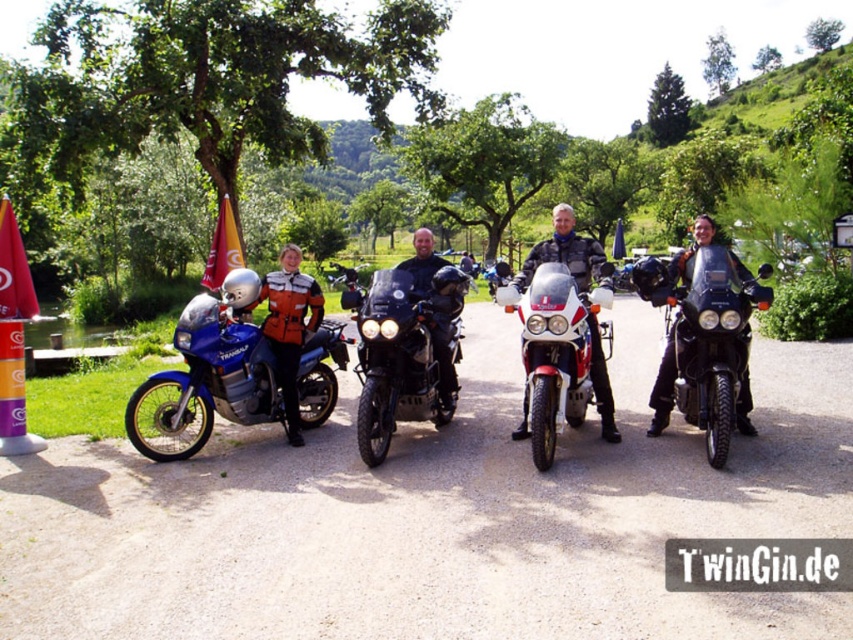
Between point (567, 268) and point (450, 275), which one is positioned in front?

Point (450, 275) is in front.

Is point (546, 291) farther from viewer compared to point (421, 252)?

No, (546, 291) is closer to viewer.

Does point (540, 342) come in front of point (440, 301)?

That is True.

Where is `red matte sportbike at center`? red matte sportbike at center is located at coordinates (554, 355).

Does shiny black motorcycle at center have a greater height compared to orange leather jacket at left?

No.

Does shiny black motorcycle at center have a smaller size compared to orange leather jacket at left?

Actually, shiny black motorcycle at center might be larger than orange leather jacket at left.

Find the location of a particular element. The image size is (853, 640). shiny black motorcycle at center is located at coordinates (398, 356).

Locate an element on the screen. shiny black motorcycle at center is located at coordinates (398, 356).

Does matte blue motorcycle at left have a greater height compared to matte black motorcycle at center?

No, matte blue motorcycle at left is not taller than matte black motorcycle at center.

Can you confirm if matte blue motorcycle at left is bigger than matte black motorcycle at center?

Correct, matte blue motorcycle at left is larger in size than matte black motorcycle at center.

Which is in front, point (242, 388) or point (432, 296)?

Point (432, 296) is more forward.

You are a GUI agent. You are given a task and a screenshot of the screen. Output one action in this format:
    pyautogui.click(x=<x>, y=<y>)
    Task: Click on the matte blue motorcycle at left
    
    Given the screenshot: What is the action you would take?
    pyautogui.click(x=206, y=381)